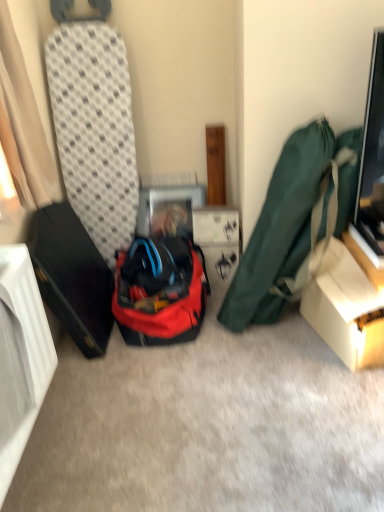
Question: Is red fabric backpack at center taller or shorter than white cardboard box at center?

Choices:
 (A) short
 (B) tall

Answer: (B)

Question: From a real-world perspective, relative to white cardboard box at center, is red fabric backpack at center vertically above or below?

Choices:
 (A) above
 (B) below

Answer: (A)

Question: Which of these objects is positioned farthest from the beige fabric curtain at left?

Choices:
 (A) matte cardboard box at lower right
 (B) green fabric bag at right
 (C) white cardboard box at center
 (D) red fabric backpack at center

Answer: (A)

Question: Estimate the real-world distances between objects in this image. Which object is closer to the white cardboard box at center?

Choices:
 (A) green fabric bag at right
 (B) red fabric backpack at center
 (C) beige fabric curtain at left
 (D) matte cardboard box at lower right

Answer: (B)